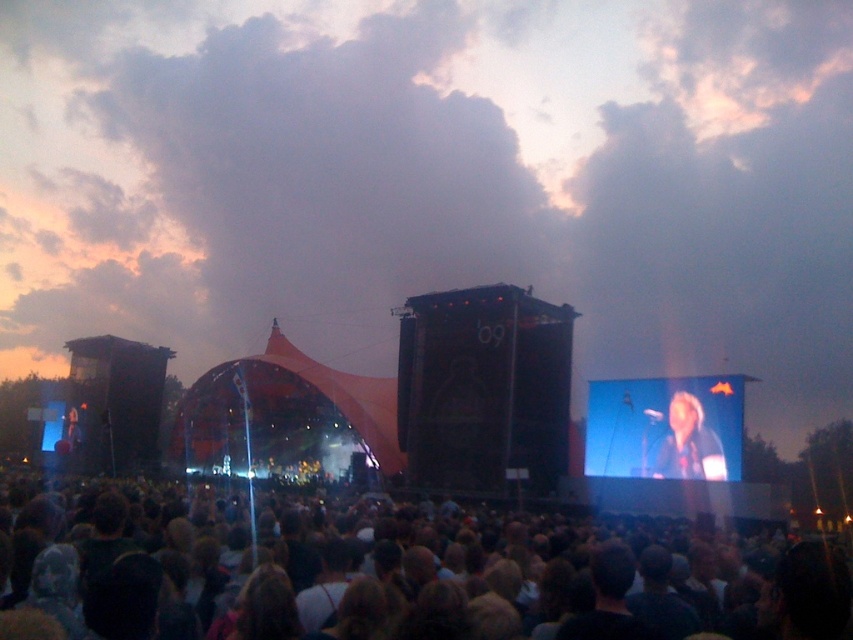
Question: Is brown hair at center above light brown leather jacket at center?

Choices:
 (A) yes
 (B) no

Answer: (B)

Question: Which of the following is the farthest from the observer?

Choices:
 (A) (589, 444)
 (B) (605, 17)
 (C) (701, 456)
 (D) (73, 406)

Answer: (D)

Question: Which of the following is the closest to the observer?

Choices:
 (A) light brown leather jacket at center
 (B) brown hair at center

Answer: (B)

Question: Is cloudy sky at upper center to the left of brown hair at center from the viewer's perspective?

Choices:
 (A) yes
 (B) no

Answer: (B)

Question: Which point is farther to the camera?

Choices:
 (A) (721, 460)
 (B) (544, 545)
 (C) (131, 268)

Answer: (C)

Question: Is matte black microphone at center smaller than light brown leather jacket at center?

Choices:
 (A) yes
 (B) no

Answer: (B)